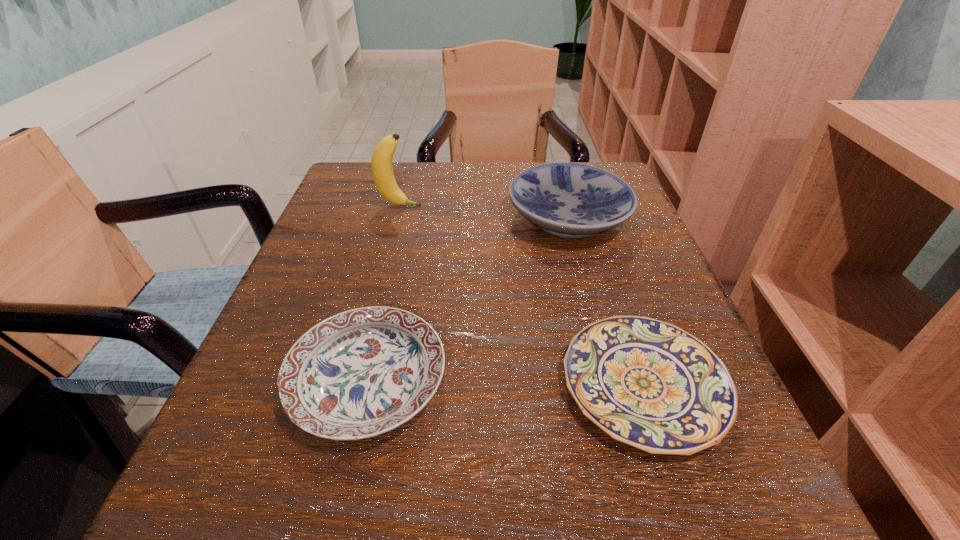
You are a GUI agent. You are given a task and a screenshot of the screen. Output one action in this format:
    pyautogui.click(x=<x>, y=<y>)
    Task: Click on the free space that is in between the farthest plate and the shortest object
    
    Given the screenshot: What is the action you would take?
    pyautogui.click(x=606, y=302)

Identify the location of vacant space in between the shortest plate and the tallest plate. The height and width of the screenshot is (540, 960). (606, 302).

In order to click on free spot between the banana and the farthest plate in this screenshot , I will do `click(484, 212)`.

Identify the location of object that stands as the second closest to the shortest plate. The width and height of the screenshot is (960, 540). (570, 200).

Locate which object is the second closest to the tallest plate. Please provide its 2D coordinates. Your answer should be formatted as a tuple, i.e. [(x, y)], where the tuple contains the x and y coordinates of a point satisfying the conditions above.

[(382, 170)]

What are the coordinates of `plate object that ranks as the third closest to the tallest object` in the screenshot? It's located at (649, 384).

Select which plate is the closest to the tallest plate. Please provide its 2D coordinates. Your answer should be formatted as a tuple, i.e. [(x, y)], where the tuple contains the x and y coordinates of a point satisfying the conditions above.

[(649, 384)]

What are the coordinates of `free point that satisfies the following two spatial constraints: 1. from the stem of the tallest object; 2. on the back side of the leftmost plate` in the screenshot? It's located at (355, 381).

This screenshot has height=540, width=960. Identify the location of free spot that satisfies the following two spatial constraints: 1. from the stem of the banana; 2. on the left side of the second shortest plate. (355, 381).

What are the coordinates of `vacant space that satisfies the following two spatial constraints: 1. from the stem of the tallest object; 2. on the back side of the tallest plate` in the screenshot? It's located at (396, 218).